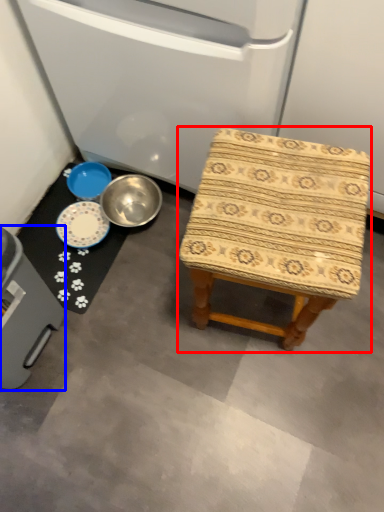
Question: Which object is further to the camera taking this photo, stool (highlighted by a red box) or appliance (highlighted by a blue box)?

Choices:
 (A) stool
 (B) appliance

Answer: (A)